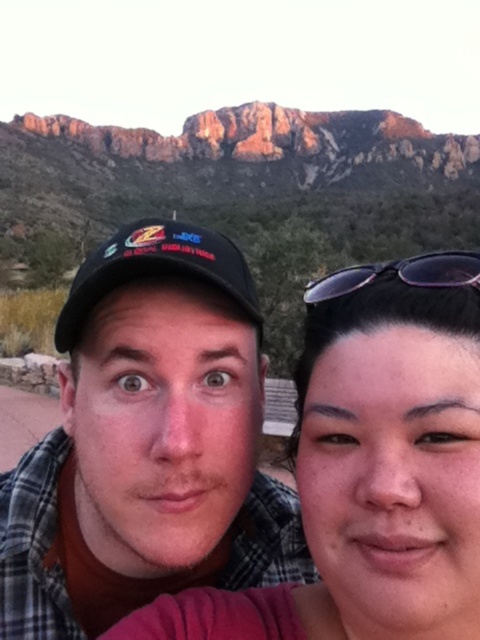
Question: Which point is farther from the camera taking this photo?

Choices:
 (A) (218, 285)
 (B) (420, 273)

Answer: (A)

Question: Does plaid shirt at center have a lesser width compared to purple plastic sunglasses at upper right?

Choices:
 (A) yes
 (B) no

Answer: (B)

Question: Is plaid shirt at center positioned before black matte baseball cap at center?

Choices:
 (A) no
 (B) yes

Answer: (B)

Question: Considering the real-world distances, which object is farthest from the purple plastic sunglasses at upper right?

Choices:
 (A) plaid shirt at center
 (B) black matte baseball cap at center

Answer: (A)

Question: Can you confirm if plaid shirt at center is positioned below black matte baseball cap at center?

Choices:
 (A) yes
 (B) no

Answer: (A)

Question: Estimate the real-world distances between objects in this image. Which object is farther from the black matte baseball cap at center?

Choices:
 (A) purple plastic sunglasses at upper right
 (B) plaid shirt at center

Answer: (A)